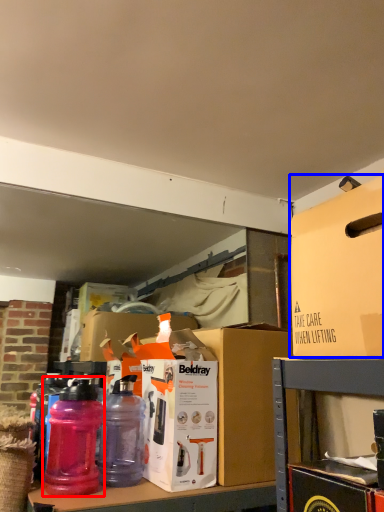
Question: Which object appears farthest to the camera in this image, bottle (highlighted by a red box) or box (highlighted by a blue box)?

Choices:
 (A) bottle
 (B) box

Answer: (A)